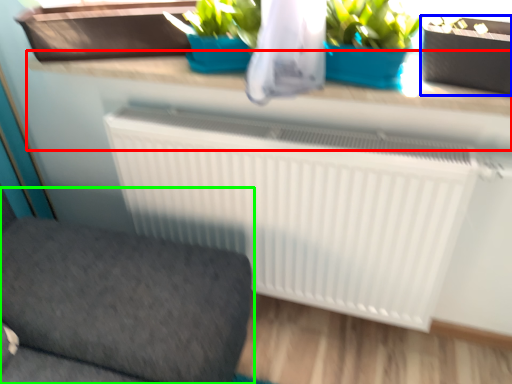
Question: Considering the real-world distances, which object is farthest from counter top (highlighted by a red box)? flowerpot (highlighted by a blue box) or furniture (highlighted by a green box)?

Choices:
 (A) flowerpot
 (B) furniture

Answer: (B)